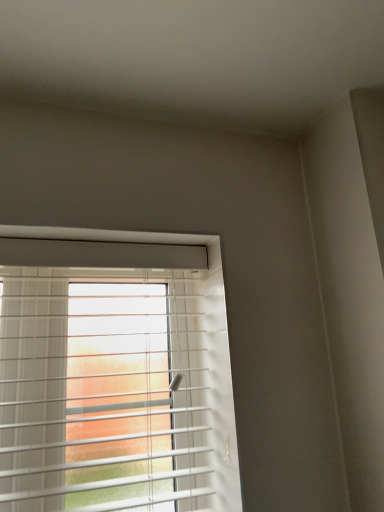
Describe the element at coordinates (103, 391) in the screenshot. This screenshot has width=384, height=512. I see `white plastic blinds at upper center` at that location.

Image resolution: width=384 pixels, height=512 pixels. Identify the location of white plastic blinds at upper center. (103, 391).

The image size is (384, 512). In order to click on white plastic blinds at upper center in this screenshot , I will do `click(103, 391)`.